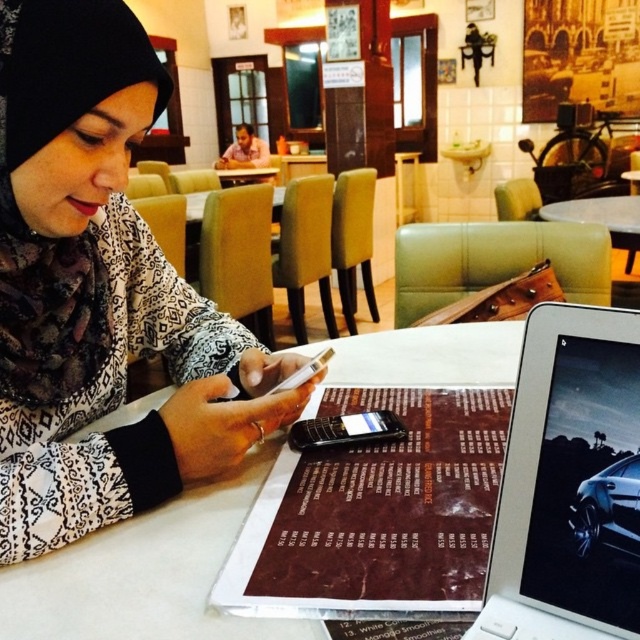
You are a server in a restaurant and need to place a 10 cm wide drink coaster between the matte black phone at center and the black glossy smartphone at center on the table. Can you fit it there based on their sizes?

The matte black phone at center is wider than the black glossy smartphone at center. Since the coaster is 10 cm wide, it depends on the exact space between them. However, since the matte black phone is larger, there might be sufficient space if positioned correctly.

In the scene shown: What are the coordinates of the matte black phone at center?

The coordinates of the matte black phone at center are 0.455 on the x axis and 0.155 on the y axis.

You are a server in a restaurant and need to place a new menu on the table. The menu is 12 inches wide. The white glossy table at center has a surface area of 24x36 inches. Can the menu fit on the table without overlapping the silver metallic laptop at center?

The silver metallic laptop at center is positioned under the white glossy table at center. Since the laptop is under the table, it does not occupy space on the table surface. The menu is 12 inches wide, and the table is 24x36 inches, so there is ample space to place the menu without overlapping anything on the table.